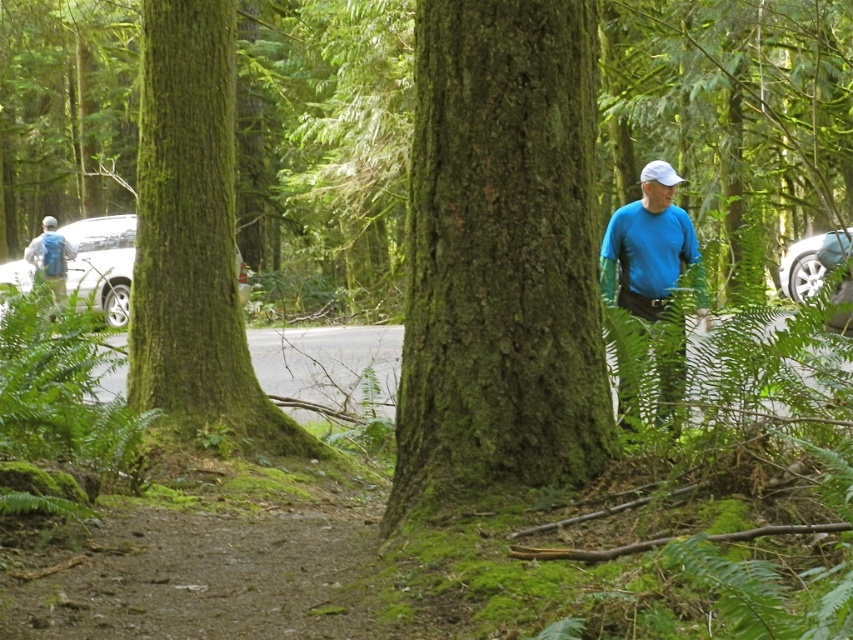
Question: Observing the image, what is the correct spatial positioning of green rough bark tree at center in reference to blue matte shirt at right?

Choices:
 (A) left
 (B) right

Answer: (A)

Question: Is green mossy tree at center closer to camera compared to matte gray backpack at left?

Choices:
 (A) no
 (B) yes

Answer: (B)

Question: Is blue matte shirt at right above metallic silver car at right?

Choices:
 (A) no
 (B) yes

Answer: (B)

Question: Which point is closer to the camera?

Choices:
 (A) white glossy car at left
 (B) green rough bark tree at center
 (C) metallic silver car at right
 (D) matte gray backpack at left

Answer: (B)

Question: Among these points, which one is farthest from the camera?

Choices:
 (A) (96, 308)
 (B) (210, 259)
 (C) (622, 385)
 (D) (498, 106)

Answer: (A)

Question: Among these objects, which one is farthest from the camera?

Choices:
 (A) white glossy car at left
 (B) matte gray backpack at left
 (C) green mossy tree at center
 (D) blue matte shirt at right

Answer: (B)